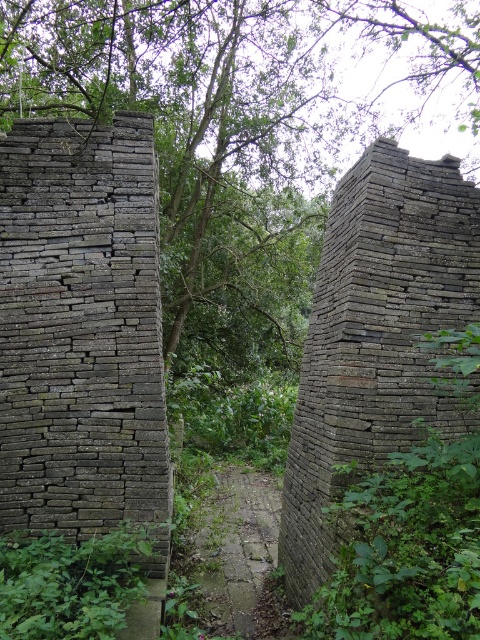
Question: Which point is farther from the camera taking this photo?

Choices:
 (A) (96, 552)
 (B) (142, 212)
 (C) (269, 616)
 (D) (374, 204)

Answer: (C)

Question: Which of the following is the closest to the observer?

Choices:
 (A) (286, 499)
 (B) (90, 320)
 (C) (278, 65)
 (D) (242, 536)

Answer: (B)

Question: Does green leafy plant at center lie in front of brick pathway at center?

Choices:
 (A) no
 (B) yes

Answer: (B)

Question: Among these points, which one is nearest to the camera?

Choices:
 (A) (315, 556)
 (B) (136, 586)
 (C) (213, 468)

Answer: (B)

Question: Is weathered stone wall at left thinner than brick pathway at center?

Choices:
 (A) no
 (B) yes

Answer: (A)

Question: Does green leafy plant at center appear on the left side of brick pathway at center?

Choices:
 (A) yes
 (B) no

Answer: (A)